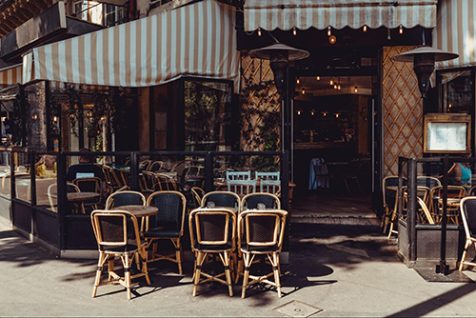
Locate an element on the screen. windows is located at coordinates (200, 113), (223, 165), (178, 171), (104, 174), (36, 175), (28, 169), (29, 118), (80, 128), (470, 95).